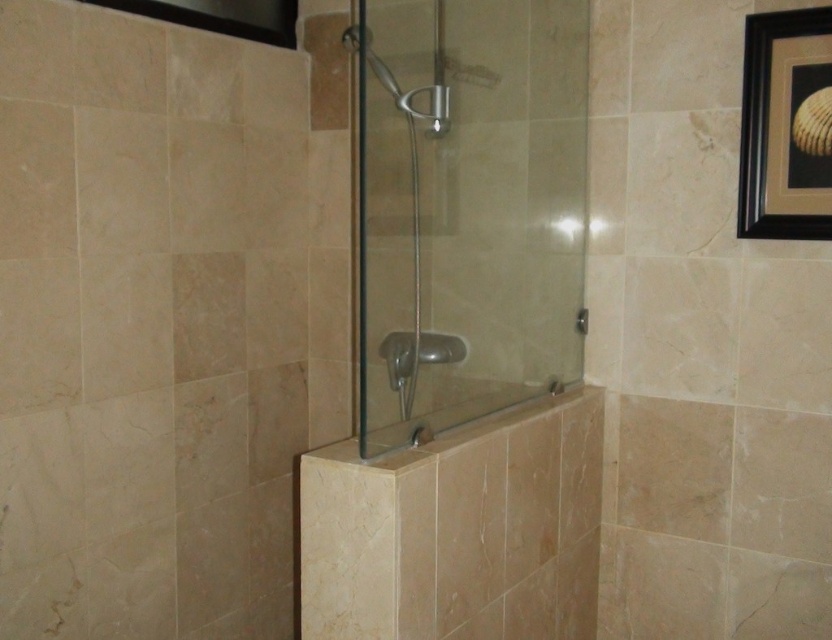
Question: Can you confirm if transparent glass shower door at center is smaller than clear glass shower head at center?

Choices:
 (A) yes
 (B) no

Answer: (B)

Question: Which point is closer to the camera?

Choices:
 (A) transparent glass shower door at center
 (B) clear glass shower head at center

Answer: (A)

Question: Does beige marble bath at center have a lesser width compared to clear glass shower head at center?

Choices:
 (A) no
 (B) yes

Answer: (A)

Question: Which is farther from the beige marble bath at center?

Choices:
 (A) clear glass shower head at center
 (B) transparent glass shower door at center
 (C) black matte picture frame at upper right

Answer: (A)

Question: Does beige marble bath at center appear over black matte picture frame at upper right?

Choices:
 (A) no
 (B) yes

Answer: (A)

Question: Among these objects, which one is farthest from the camera?

Choices:
 (A) beige marble bath at center
 (B) clear glass shower head at center
 (C) black matte picture frame at upper right

Answer: (C)